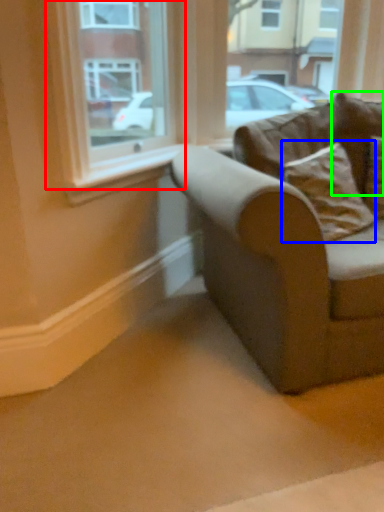
Question: Considering the real-world distances, which object is closest to window (highlighted by a red box)? pillow (highlighted by a blue box) or pillow (highlighted by a green box).

Choices:
 (A) pillow
 (B) pillow

Answer: (B)